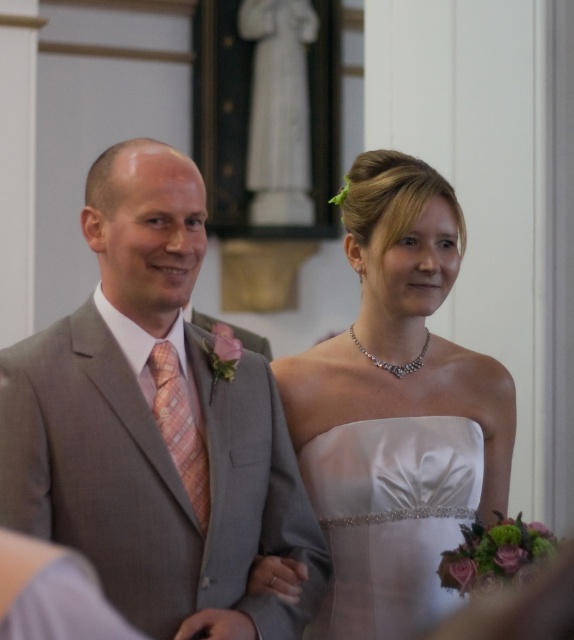
Is gray suit at center in front of white satin dress at center?

Yes, gray suit at center is closer to the viewer.

What do you see at coordinates (154, 426) in the screenshot? I see `gray suit at center` at bounding box center [154, 426].

Locate an element on the screen. The image size is (574, 640). gray suit at center is located at coordinates click(x=154, y=426).

Between satin white dress at center and light peach plaid tie at center, which one has less height?

light peach plaid tie at center

Based on the photo, between satin white dress at center and light peach plaid tie at center, which one appears on the right side from the viewer's perspective?

satin white dress at center

Does point (360, 524) come in front of point (160, 390)?

No, (360, 524) is further to viewer.

At what (x,y) coordinates should I click in order to perform the action: click on satin white dress at center. Please return your answer as a coordinate pair (x, y). Looking at the image, I should click on (390, 518).

Does white satin dress at center have a larger size compared to satin white dress at center?

Yes.

Who is positioned more to the left, white satin dress at center or satin white dress at center?

Positioned to the left is satin white dress at center.

You are a GUI agent. You are given a task and a screenshot of the screen. Output one action in this format:
    pyautogui.click(x=<x>, y=<y>)
    Task: Click on the white satin dress at center
    The image size is (574, 640).
    Given the screenshot: What is the action you would take?
    pyautogui.click(x=397, y=410)

At what (x,y) coordinates should I click in order to perform the action: click on white satin dress at center. Please return your answer as a coordinate pair (x, y). The image size is (574, 640). Looking at the image, I should click on (397, 410).